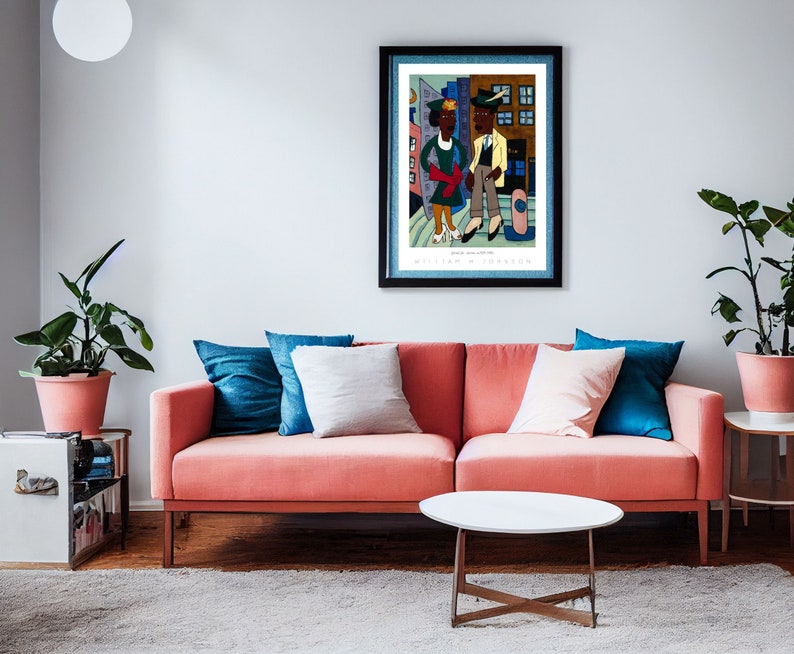
Where is `x pattern of wood support pieces of table`? The height and width of the screenshot is (654, 794). x pattern of wood support pieces of table is located at coordinates (521, 604).